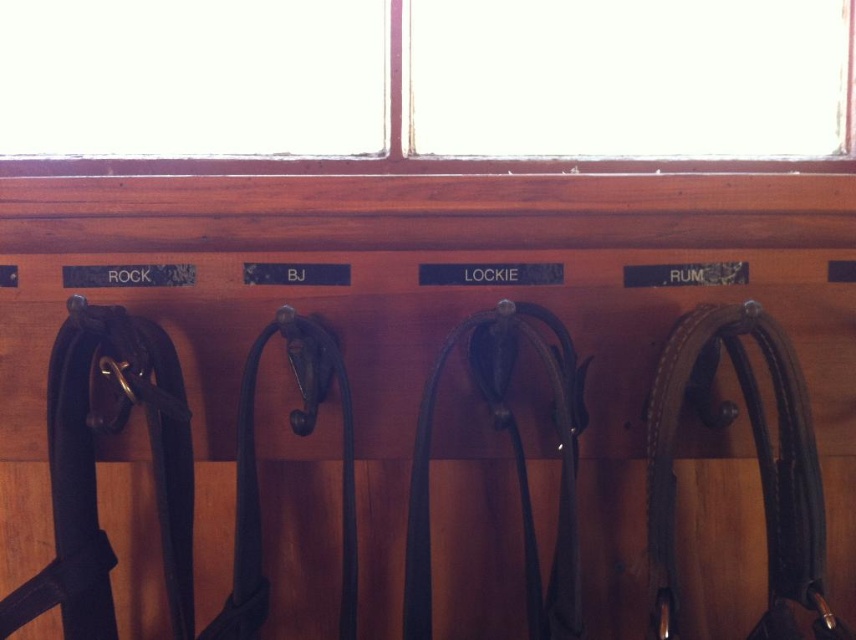
Is point (660, 433) positioned behind point (253, 163)?

No.

Can you confirm if leather strap at right is positioned above clear glass window at upper center?

No.

Is point (822, 584) behind point (424, 168)?

No, it is not.

Find the location of a particular element. leather strap at right is located at coordinates (758, 461).

Locate an element on the screen. black leather strap at center is located at coordinates (514, 464).

The width and height of the screenshot is (856, 640). Describe the element at coordinates (514, 464) in the screenshot. I see `black leather strap at center` at that location.

Between point (568, 589) and point (345, 161), which one is positioned behind?

The point (345, 161) is behind.

At what (x,y) coordinates should I click in order to perform the action: click on black leather strap at center. Please return your answer as a coordinate pair (x, y). Image resolution: width=856 pixels, height=640 pixels. Looking at the image, I should click on (514, 464).

Describe the element at coordinates (758, 461) in the screenshot. The width and height of the screenshot is (856, 640). I see `leather strap at right` at that location.

Does point (658, 454) come behind point (440, 365)?

That is False.

Find the location of a particular element. leather strap at right is located at coordinates (758, 461).